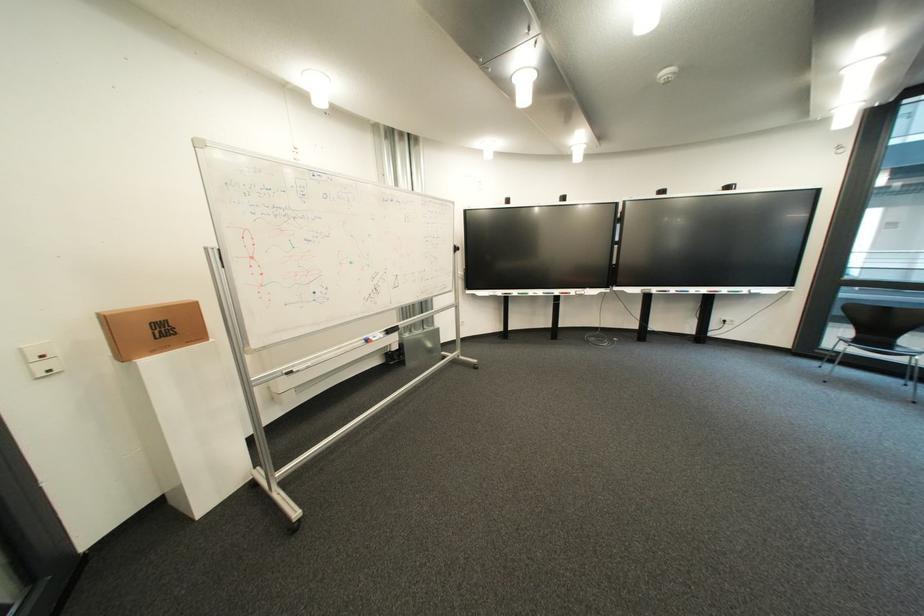
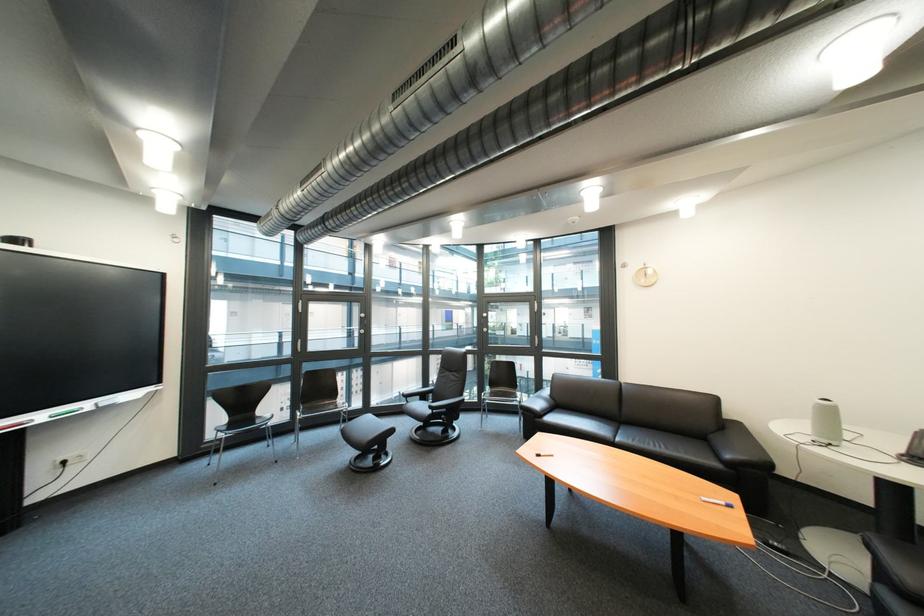
Locate, in the second image, the point that corresponds to point (758, 292) in the first image.

(101, 406)